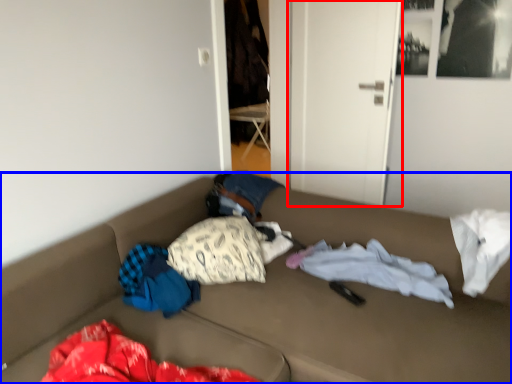
Question: Which object is closer to the camera taking this photo, door (highlighted by a red box) or furniture (highlighted by a blue box)?

Choices:
 (A) door
 (B) furniture

Answer: (B)